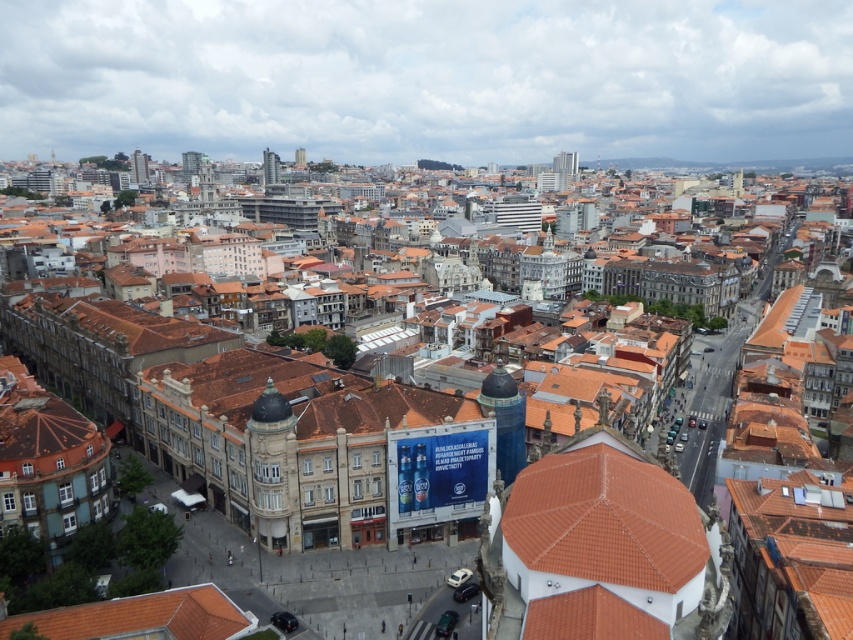
You are standing in the city square and see both the terracotta tiled dome at center and the gold textured dome at center. Which dome is positioned to the right when facing the city square?

The terracotta tiled dome at center is positioned to the right of the gold textured dome at center when facing the city square.

You are standing in the city square and want to take a photo of the terracotta tiled dome at center. If your camera has a maximum zoom range of 50 meters, will you be able to capture the dome clearly without moving closer?

The terracotta tiled dome at center is 71.79 meters away from the camera. Since the camera can only zoom up to 50 meters, you won cannot capture it clearly without moving closer.

You are standing at point A located at coordinates point A at (x=641, y=518). You want to walk to point B, which is 250.78 feet away. Is there a direct path between point A and point B without any obstacles?

The points are 250.78 feet apart, but the scene description mentions intricate road layouts with several intersections and narrow streets. While there might be a path, it would likely involve navigating through the city streets rather than a direct route. The answer depends on the specific path, but based on the given information, there is no mention of a direct obstacle between them. However, the streets are narrow and have intersections, so a direct path might not exist. The answer is unclear without more